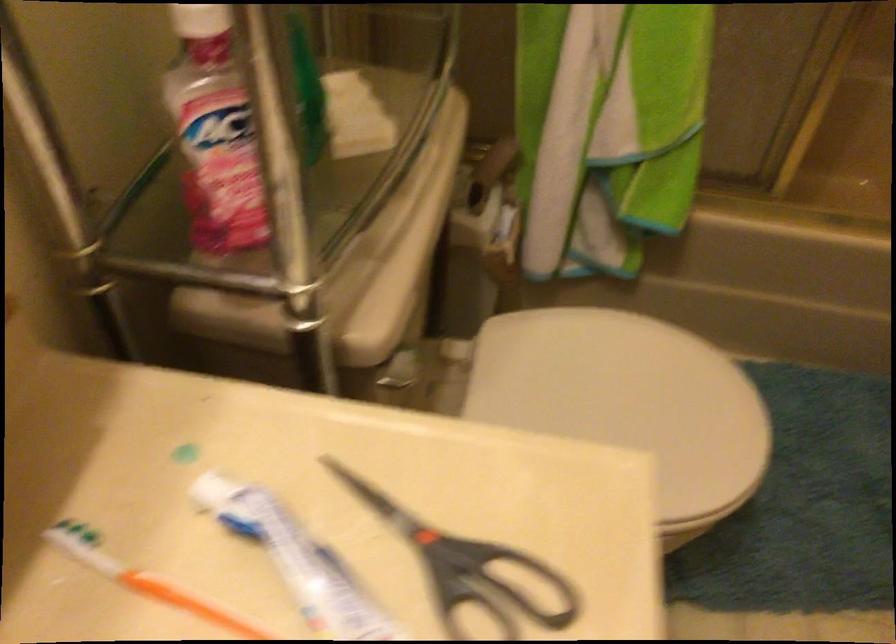
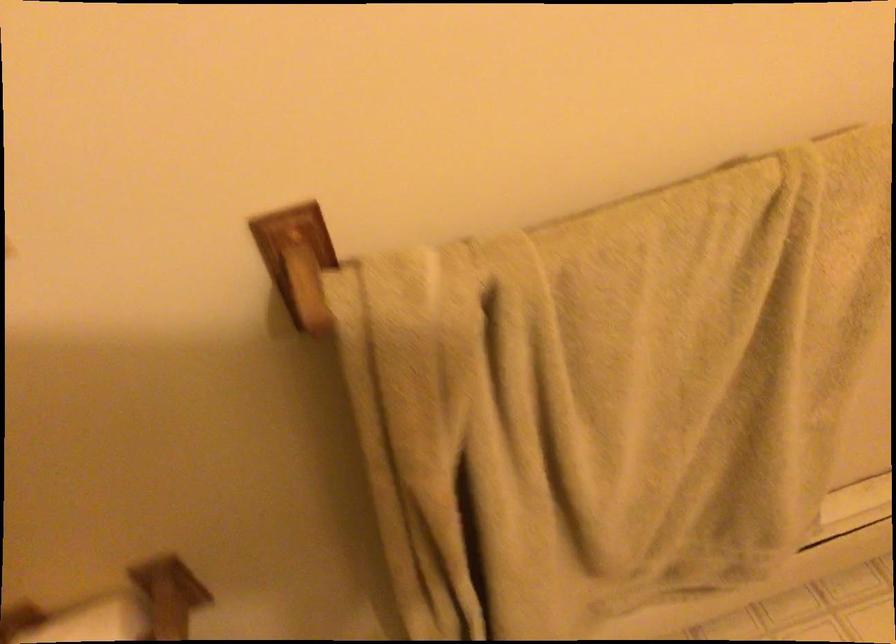
How did the camera likely rotate?

The rotation direction of the camera is right-down.